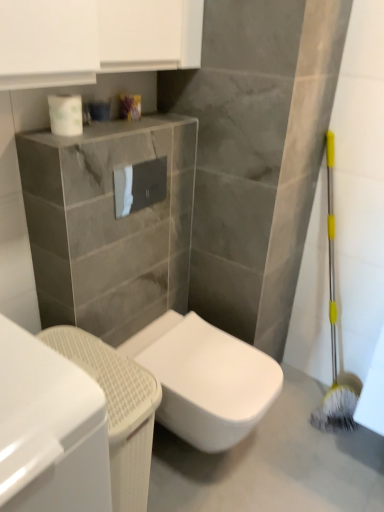
Question: Is white glossy toilet at center surrounded by white glossy cabinet at lower left?

Choices:
 (A) yes
 (B) no

Answer: (B)

Question: Is white glossy cabinet at lower left thinner than white glossy toilet at center?

Choices:
 (A) no
 (B) yes

Answer: (B)

Question: Considering the relative positions of white glossy cabinet at lower left and white glossy toilet at center in the image provided, is white glossy cabinet at lower left to the left of white glossy toilet at center from the viewer's perspective?

Choices:
 (A) yes
 (B) no

Answer: (A)

Question: Can you confirm if white glossy cabinet at lower left is positioned to the right of white glossy toilet at center?

Choices:
 (A) yes
 (B) no

Answer: (B)

Question: Is the position of white glossy cabinet at lower left more distant than that of white glossy toilet at center?

Choices:
 (A) yes
 (B) no

Answer: (B)

Question: Is white glossy cabinet at lower left looking in the opposite direction of white glossy toilet at center?

Choices:
 (A) no
 (B) yes

Answer: (A)

Question: From the image's perspective, is white glossy toilet paper at center, arranged as the 2th toilet paper when viewed from the front, located beneath white glossy toilet paper at upper center, arranged as the 1th toilet paper when viewed from the front?

Choices:
 (A) yes
 (B) no

Answer: (A)

Question: Is the depth of white glossy toilet paper at center, the first toilet paper from the back, greater than that of white glossy toilet paper at upper center, the 1th toilet paper viewed from the left?

Choices:
 (A) no
 (B) yes

Answer: (B)

Question: Considering the relative sizes of white glossy toilet paper at center, the 1th toilet paper from the bottom, and white glossy toilet paper at upper center, the 1th toilet paper when ordered from top to bottom, in the image provided, is white glossy toilet paper at center, the 1th toilet paper from the bottom, shorter than white glossy toilet paper at upper center, the 1th toilet paper when ordered from top to bottom,?

Choices:
 (A) no
 (B) yes

Answer: (A)

Question: Is white glossy toilet paper at center, marked as the first toilet paper in a right-to-left arrangement, oriented towards white glossy toilet paper at upper center, arranged as the 1th toilet paper when viewed from the front?

Choices:
 (A) no
 (B) yes

Answer: (A)

Question: Is white glossy toilet paper at center, the 2th toilet paper from the top, at the left side of white glossy toilet paper at upper center, placed as the 2th toilet paper when sorted from right to left?

Choices:
 (A) yes
 (B) no

Answer: (B)

Question: From a real-world perspective, is white glossy toilet paper at center, which is the second toilet paper in left-to-right order, beneath white glossy toilet paper at upper center, acting as the second toilet paper starting from the back?

Choices:
 (A) no
 (B) yes

Answer: (B)

Question: From the image's perspective, is white glossy toilet paper at center, the first toilet paper from the back, above white glossy toilet at center?

Choices:
 (A) no
 (B) yes

Answer: (B)